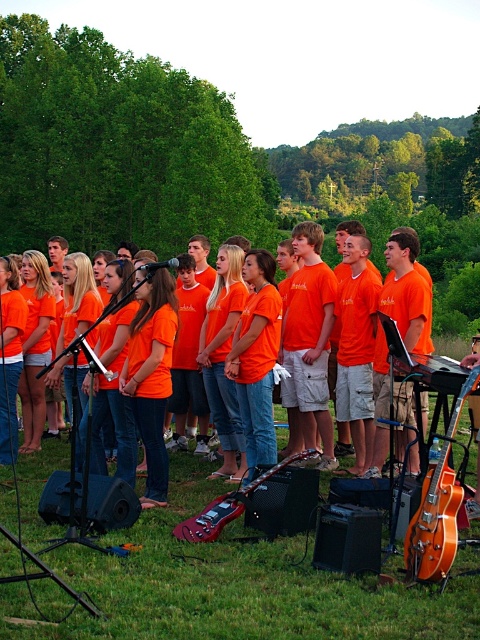
Looking at this image, you are a photographer standing at the center of the group. You want to capture a photo that includes both the point marked at coordinate (227, 506) and the orange electric guitar on the right. Which direction should you move to ensure both are in frame?

The point marked at coordinate (227, 506) indicates the glossy red electric guitar at lower center. To include both the glossy red electric guitar at lower center and the orange electric guitar on the right in your photo, you should move to the left. This will allow the camera to capture the red electric guitar positioned at lower center while also framing the orange electric guitar on the right side of the image.

From the picture: You are a photographer trying to capture a wide shot of the choir group. The orange wood electric guitar at lower right is in your current frame. To ensure it doesn not block the choir members, where should you adjust your camera position?

Move the camera to the left to avoid the orange wood electric guitar at lower right, as it is positioned at point 0.795 on the x axis and 0.912 on the y axis, which places it on the right side of the frame.

You are a photographer taking a picture of the group. You want to ensure both the orange cotton shirt at center and the glossy wood guitar at right are clearly visible in the frame. Based on their positions, which object should you focus on first to ensure both are in focus?

The orange cotton shirt at center is positioned on the left side of glossy wood guitar at right. To ensure both are in focus, you should focus on the orange cotton shirt at center first since it is closer to the foreground, allowing the guitar to remain in focus as well due to the depth of field.